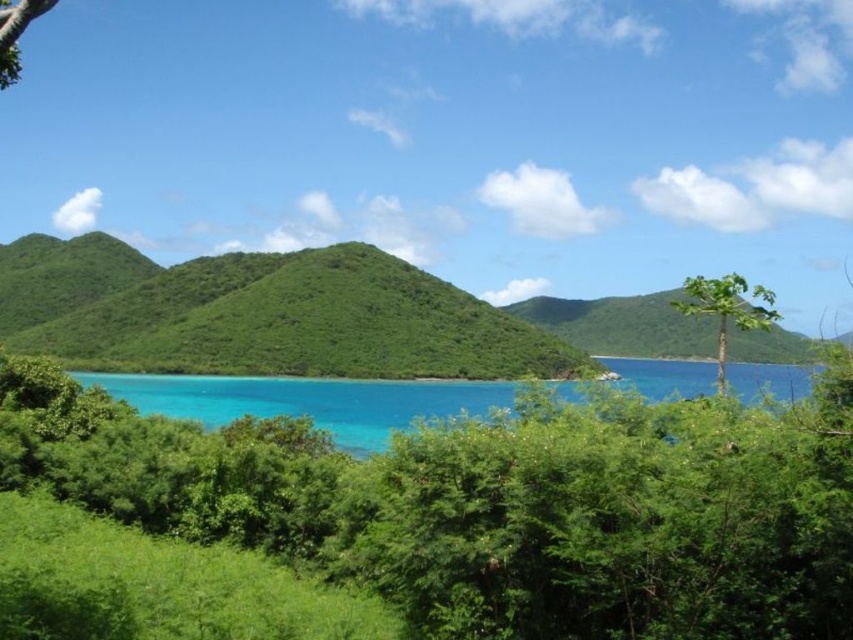
Does green leafy hill at center have a larger size compared to turquoise water at center?

Yes, green leafy hill at center is bigger than turquoise water at center.

Which is more to the left, green leafy hill at center or turquoise water at center?

From the viewer's perspective, green leafy hill at center appears more on the left side.

Does point (358, 278) lie behind point (780, 394)?

Yes, point (358, 278) is farther from viewer.

You are a GUI agent. You are given a task and a screenshot of the screen. Output one action in this format:
    pyautogui.click(x=<x>, y=<y>)
    Task: Click on the green leafy hill at center
    This screenshot has width=853, height=640.
    Given the screenshot: What is the action you would take?
    pyautogui.click(x=260, y=314)

Is point (274, 260) positioned in front of point (686, 285)?

No, it is behind (686, 285).

Is point (323, 289) in front of point (704, 289)?

No.

Identify the location of green leafy hill at center. Image resolution: width=853 pixels, height=640 pixels. (260, 314).

Based on the photo, which of these two, green leafy tree at right or green leafy tree at upper left, stands shorter?

green leafy tree at upper left

Who is lower down, green leafy tree at right or green leafy tree at upper left?

Positioned lower is green leafy tree at right.

Between point (730, 300) and point (18, 74), which one is positioned behind?

The point (730, 300) is behind.

Find the location of `green leafy tree at right`. green leafy tree at right is located at coordinates (727, 308).